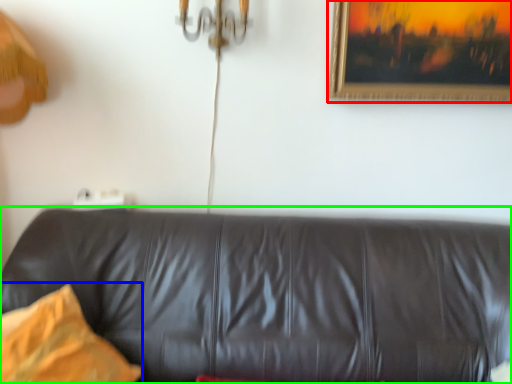
Question: Which is farther away from picture frame (highlighted by a red box)? pillow (highlighted by a blue box) or studio couch (highlighted by a green box)?

Choices:
 (A) pillow
 (B) studio couch

Answer: (A)